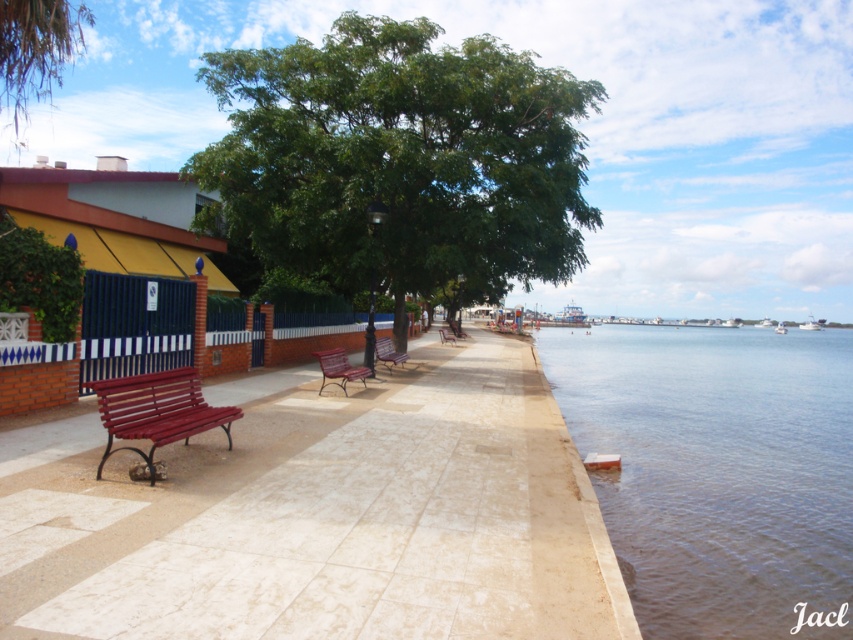
Is white marble pavement at center below metallic red bench at center?

Yes.

Which is above, white marble pavement at center or metallic red bench at center?

metallic red bench at center

Is point (444, 348) positioned after point (454, 342)?

No, it is in front of (454, 342).

This screenshot has width=853, height=640. What are the coordinates of `white marble pavement at center` in the screenshot? It's located at (320, 515).

Can you confirm if green leafy tree at center is positioned above brown concrete water at lower right?

Yes, green leafy tree at center is above brown concrete water at lower right.

Consider the image. Who is positioned more to the left, green leafy tree at center or brown concrete water at lower right?

green leafy tree at center is more to the left.

Which is behind, point (242, 115) or point (653, 592)?

Positioned behind is point (242, 115).

In order to click on green leafy tree at center in this screenshot , I will do `click(401, 161)`.

Does matte red bench at left have a lesser height compared to green leafy tree at upper center?

Correct, matte red bench at left is not as tall as green leafy tree at upper center.

At what (x,y) coordinates should I click in order to perform the action: click on matte red bench at left. Please return your answer as a coordinate pair (x, y). Looking at the image, I should click on (155, 410).

The height and width of the screenshot is (640, 853). What do you see at coordinates (155, 410) in the screenshot?
I see `matte red bench at left` at bounding box center [155, 410].

I want to click on matte red bench at left, so click(x=155, y=410).